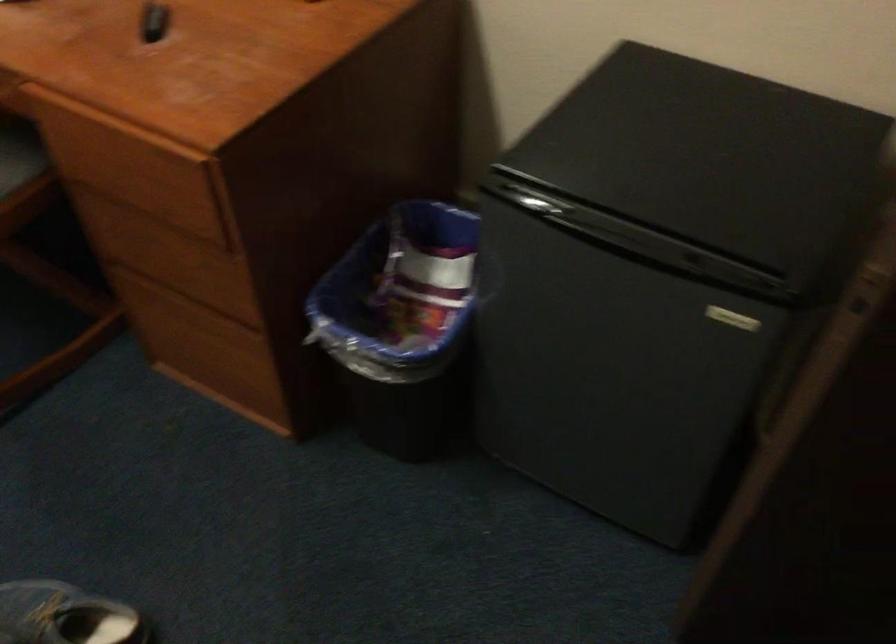
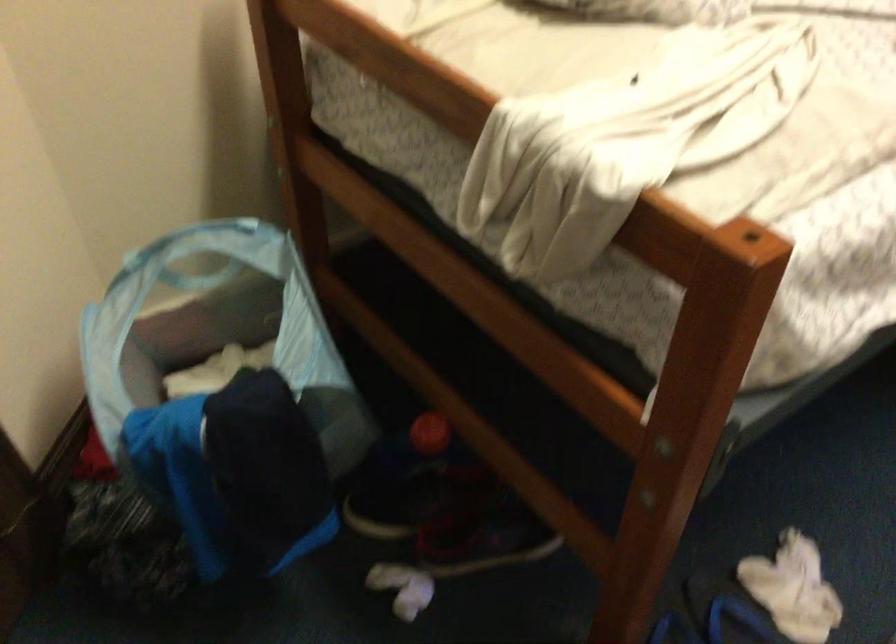
How did the camera likely rotate?

The camera rotated toward left-down.